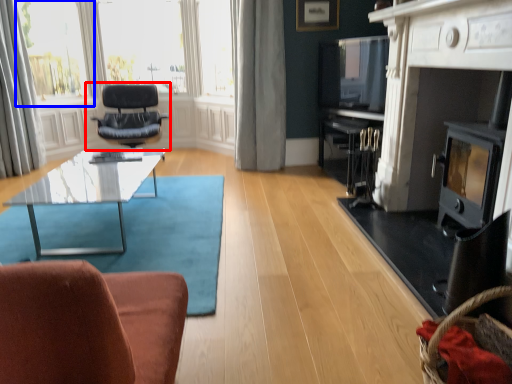
Question: Among these objects, which one is farthest to the camera, chair (highlighted by a red box) or bay window (highlighted by a blue box)?

Choices:
 (A) chair
 (B) bay window

Answer: (B)